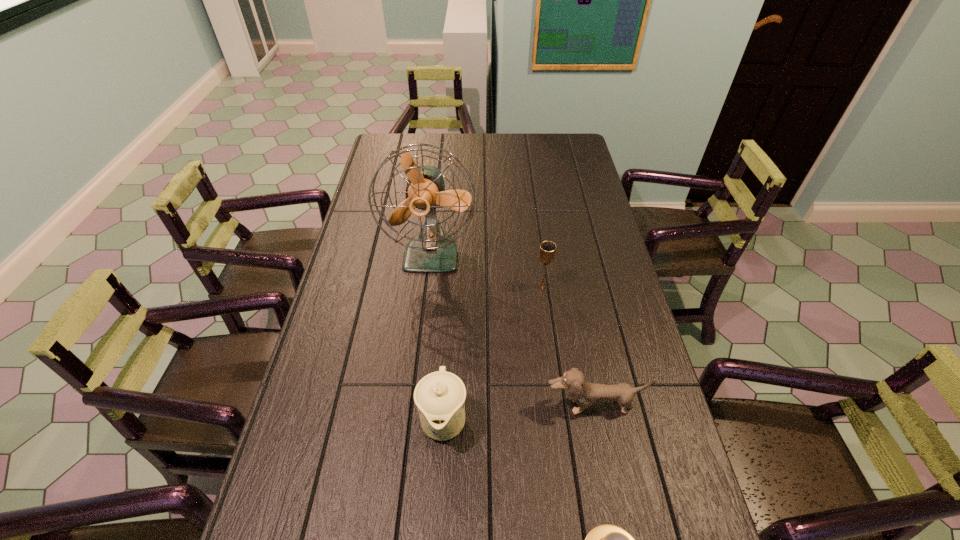
Image resolution: width=960 pixels, height=540 pixels. I want to click on vacant area at the far edge of the desktop, so click(x=514, y=148).

You are a GUI agent. You are given a task and a screenshot of the screen. Output one action in this format:
    pyautogui.click(x=<x>, y=<y>)
    Task: Click on the free space at the left edge of the desktop
    The image size is (960, 540).
    Given the screenshot: What is the action you would take?
    pyautogui.click(x=372, y=202)

At what (x,y) coordinates should I click in order to perform the action: click on vacant space at the right edge of the desktop. Please return your answer as a coordinate pair (x, y). Looking at the image, I should click on point(585,196).

Image resolution: width=960 pixels, height=540 pixels. What are the coordinates of `vacant space at the far right corner of the desktop` in the screenshot? It's located at (569, 150).

Where is `free spot between the second shortest object and the chalice`? The image size is (960, 540). free spot between the second shortest object and the chalice is located at coordinates (567, 346).

The image size is (960, 540). Find the location of `empty space that is in between the puppy and the chinaware`. empty space that is in between the puppy and the chinaware is located at coordinates (518, 413).

Where is `vacant space in between the puppy and the chinaware`? The width and height of the screenshot is (960, 540). vacant space in between the puppy and the chinaware is located at coordinates (518, 413).

You are a GUI agent. You are given a task and a screenshot of the screen. Output one action in this format:
    pyautogui.click(x=<x>, y=<y>)
    Task: Click on the vacant area that lies between the second shortest object and the chinaware
    
    Given the screenshot: What is the action you would take?
    pyautogui.click(x=518, y=413)

Identify the location of vacant space that's between the puppy and the chinaware. (518, 413).

Find the location of a particular element. free space between the chalice and the tallest object is located at coordinates (487, 271).